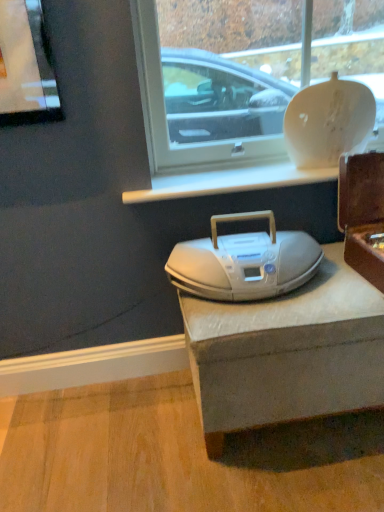
Question: From a real-world perspective, is white plastic boombox at center physically above white glossy vase at upper center?

Choices:
 (A) yes
 (B) no

Answer: (B)

Question: Does white plastic boombox at center have a greater width compared to white glossy vase at upper center?

Choices:
 (A) yes
 (B) no

Answer: (A)

Question: Is white plastic boombox at center completely or partially outside of white glossy vase at upper center?

Choices:
 (A) no
 (B) yes

Answer: (B)

Question: Does white plastic boombox at center appear on the right side of white glossy vase at upper center?

Choices:
 (A) yes
 (B) no

Answer: (B)

Question: Is white plastic boombox at center taller than white glossy vase at upper center?

Choices:
 (A) yes
 (B) no

Answer: (B)

Question: Are white plastic boombox at center and white glossy vase at upper center far apart?

Choices:
 (A) yes
 (B) no

Answer: (A)

Question: Is brown wooden box at right looking in the opposite direction of white glossy vase at upper center?

Choices:
 (A) yes
 (B) no

Answer: (B)

Question: Is brown wooden box at right with white glossy vase at upper center?

Choices:
 (A) yes
 (B) no

Answer: (B)

Question: Is white glossy vase at upper center inside brown wooden box at right?

Choices:
 (A) yes
 (B) no

Answer: (B)

Question: Is brown wooden box at right shorter than white glossy vase at upper center?

Choices:
 (A) yes
 (B) no

Answer: (A)

Question: Considering the relative sizes of brown wooden box at right and white glossy vase at upper center in the image provided, is brown wooden box at right wider than white glossy vase at upper center?

Choices:
 (A) no
 (B) yes

Answer: (B)

Question: From the image's perspective, is brown wooden box at right located beneath white glossy vase at upper center?

Choices:
 (A) no
 (B) yes

Answer: (B)

Question: Is brown wooden box at right positioned before white plastic boombox at center?

Choices:
 (A) no
 (B) yes

Answer: (B)